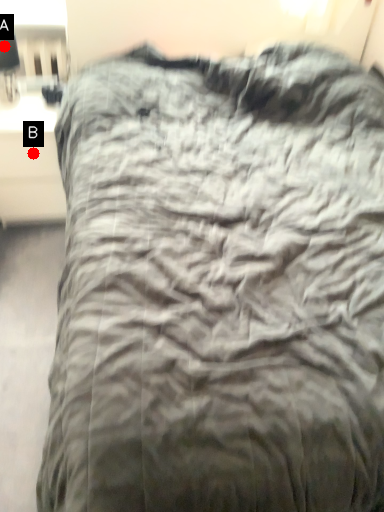
Question: Two points are circled on the image, labeled by A and B beside each circle. Which point is closer to the camera?

Choices:
 (A) A is closer
 (B) B is closer

Answer: (A)